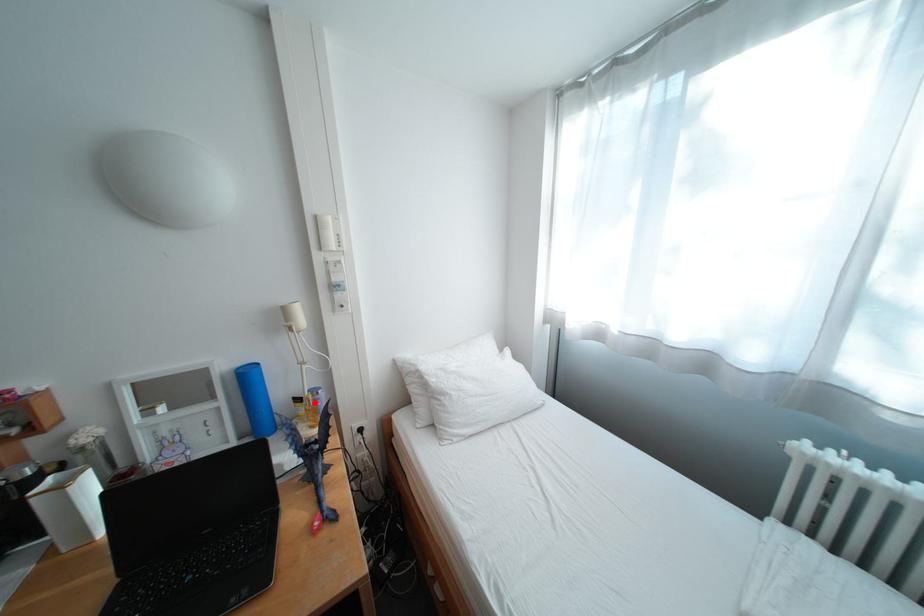
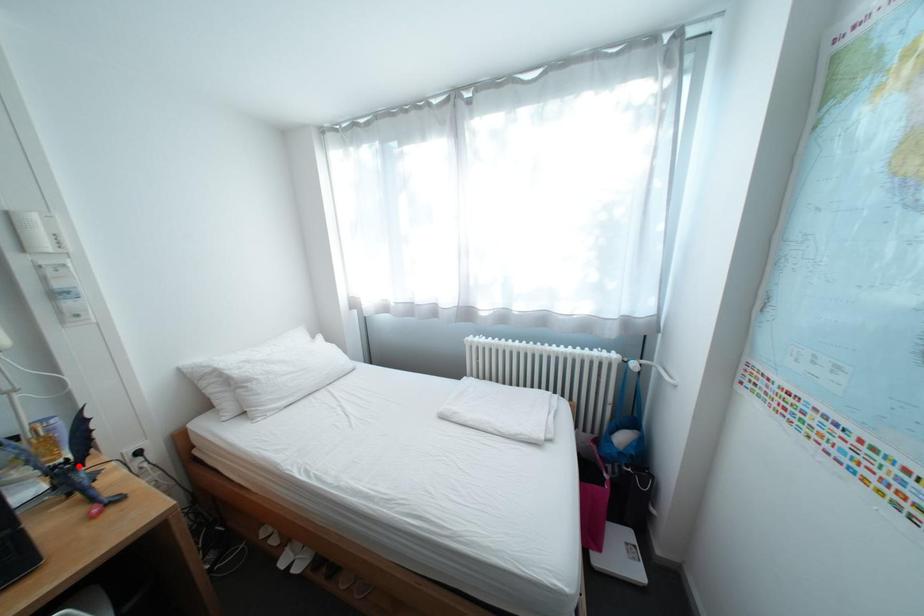
I am providing you with two images of the same scene from different viewpoints. A red point is marked on the first image and another point is marked on the second image. Are the points marked in image1 and image2 representing the same 3D position?

No